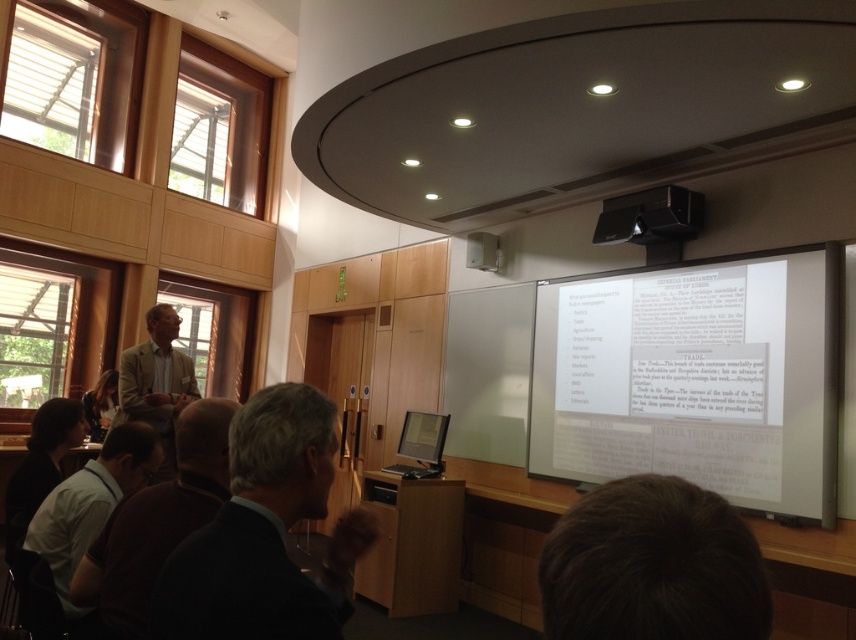
Is dark suit at center shorter than dark brown shirt at lower left?

Indeed, dark suit at center has a lesser height compared to dark brown shirt at lower left.

Looking at this image, who is positioned more to the right, dark suit at center or dark brown shirt at lower left?

dark suit at center is more to the right.

Does point (278, 616) lie behind point (135, 588)?

No, it is in front of (135, 588).

You are a GUI agent. You are given a task and a screenshot of the screen. Output one action in this format:
    pyautogui.click(x=<x>, y=<y>)
    Task: Click on the dark suit at center
    Image resolution: width=856 pixels, height=640 pixels.
    Given the screenshot: What is the action you would take?
    pyautogui.click(x=265, y=532)

Is dark gray shirt at lower left to the right of matte black monitor at center from the viewer's perspective?

No, dark gray shirt at lower left is not to the right of matte black monitor at center.

Who is more distant from viewer, (98, 504) or (428, 444)?

The point (428, 444) is more distant.

The width and height of the screenshot is (856, 640). I want to click on dark gray shirt at lower left, so click(x=90, y=509).

Which is more to the left, dark suit at center or black plastic projector at upper center?

From the viewer's perspective, dark suit at center appears more on the left side.

Measure the distance between dark suit at center and camera.

dark suit at center is 32.12 inches from camera.

Between point (174, 566) and point (629, 202), which one is positioned in front?

Point (174, 566) is more forward.

Locate an element on the screen. dark suit at center is located at coordinates (265, 532).